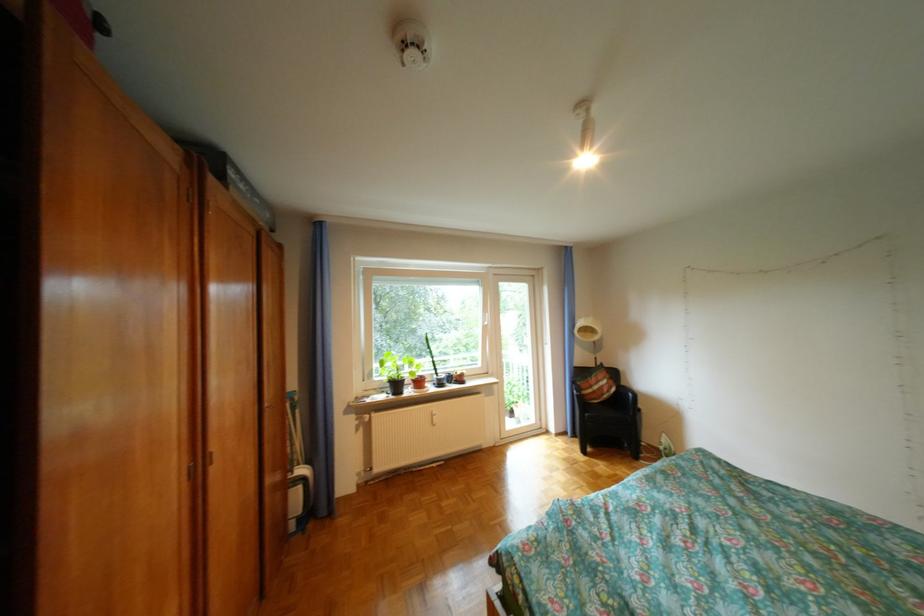
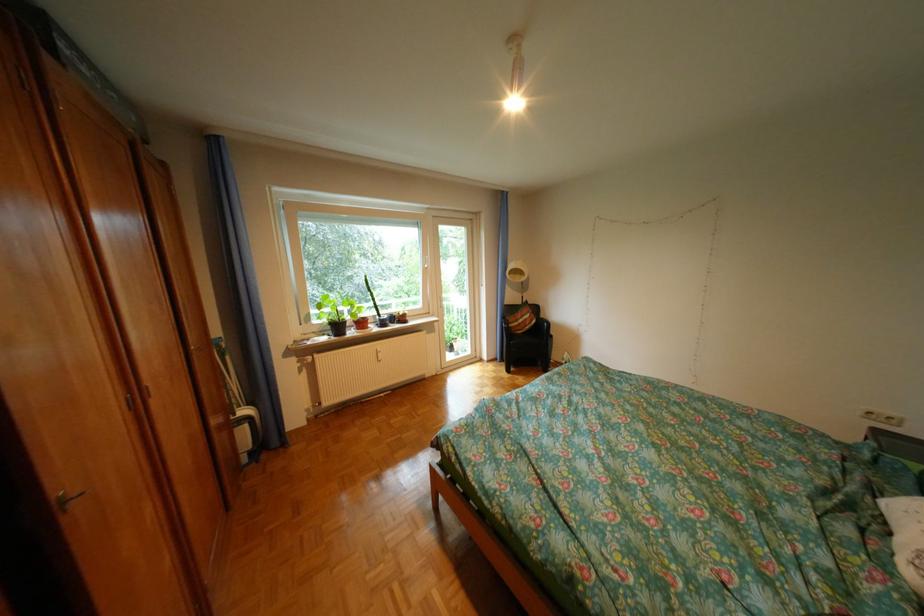
Question: How did the camera likely rotate?

Choices:
 (A) Left
 (B) Right
 (C) Up
 (D) Down

Answer: (B)